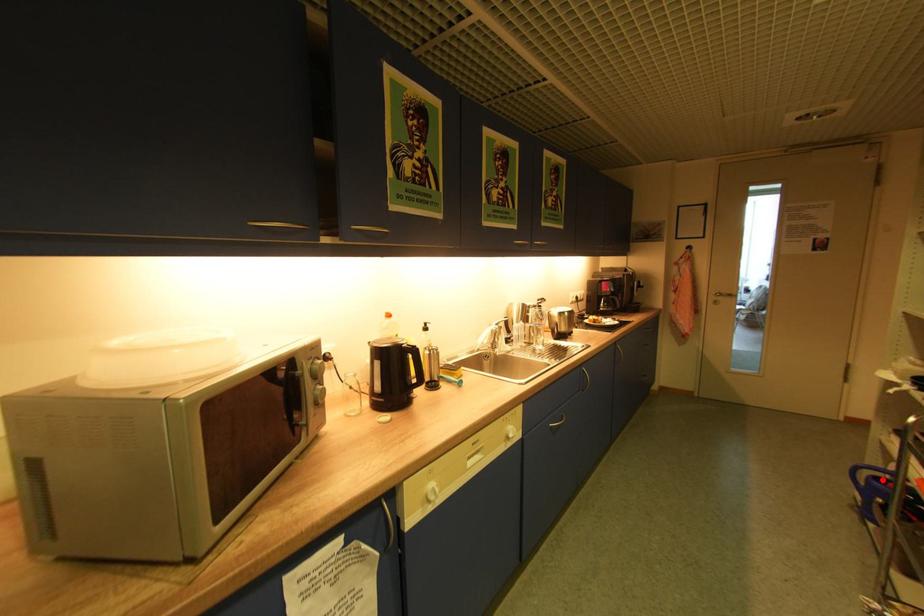
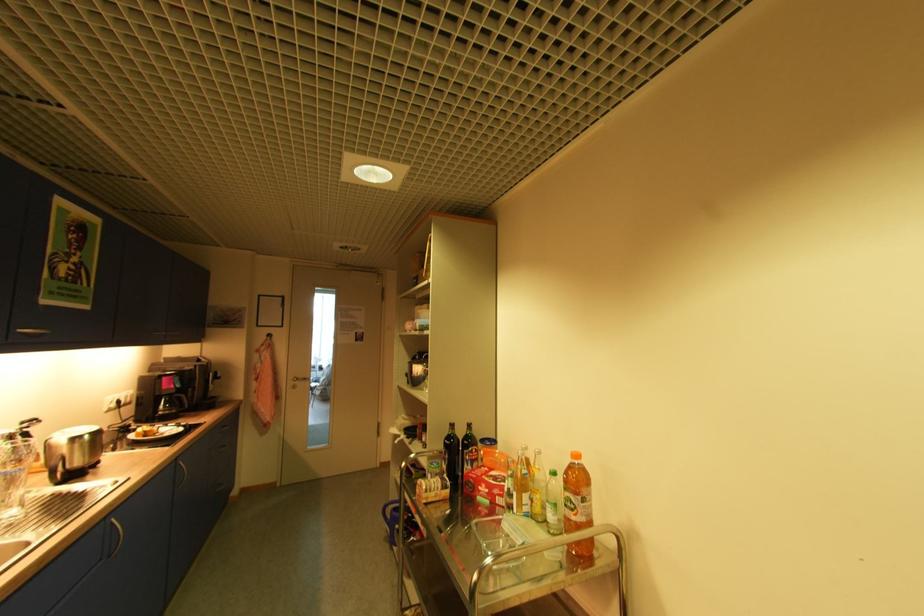
Locate, in the second image, the point that corresponds to the highlighted location in the first image.

(400, 509)